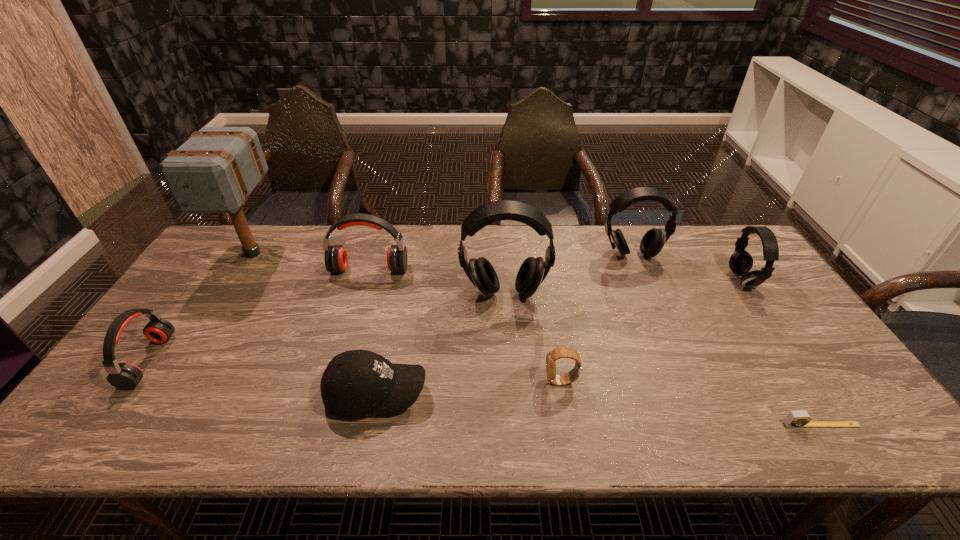
At what (x,y) coordinates should I click in order to perform the action: click on free space between the tape measure and the baseball cap. Please return your answer as a coordinate pair (x, y). This screenshot has width=960, height=540. Looking at the image, I should click on (599, 409).

At what (x,y) coordinates should I click in order to perform the action: click on unoccupied area between the biggest black earphone and the shortest object. Please return your answer as a coordinate pair (x, y). This screenshot has height=540, width=960. Looking at the image, I should click on (662, 359).

Point out which object is positioned as the sixth nearest to the fourth earphone from right to left. Please provide its 2D coordinates. Your answer should be formatted as a tuple, i.e. [(x, y)], where the tuple contains the x and y coordinates of a point satisfying the conditions above.

[(653, 241)]

The height and width of the screenshot is (540, 960). What are the coordinates of `object that stands as the fifth closest to the shortest object` in the screenshot? It's located at (355, 383).

You are a GUI agent. You are given a task and a screenshot of the screen. Output one action in this format:
    pyautogui.click(x=<x>, y=<y>)
    Task: Click on the earphone that stands as the third closest to the farther red earphone
    
    Given the screenshot: What is the action you would take?
    pyautogui.click(x=653, y=241)

Find the location of a particular element. This screenshot has width=960, height=540. the third closest earphone to the smallest black earphone is located at coordinates (336, 259).

Identify the location of black earphone that stands as the second closest to the biggest black earphone. This screenshot has height=540, width=960. (740, 262).

Identify which black earphone is located as the second nearest to the shortest earphone. Please provide its 2D coordinates. Your answer should be formatted as a tuple, i.e. [(x, y)], where the tuple contains the x and y coordinates of a point satisfying the conditions above.

[(653, 241)]

Identify the location of free space that satisfies the following two spatial constraints: 1. on the striking surface of the mallet; 2. on the ear cups of the smaller red earphone. This screenshot has width=960, height=540. (186, 361).

Identify the location of vacant region that satisfies the following two spatial constraints: 1. on the ear cups of the biggest black earphone; 2. on the front-facing side of the baseball cap. The width and height of the screenshot is (960, 540). tap(511, 394).